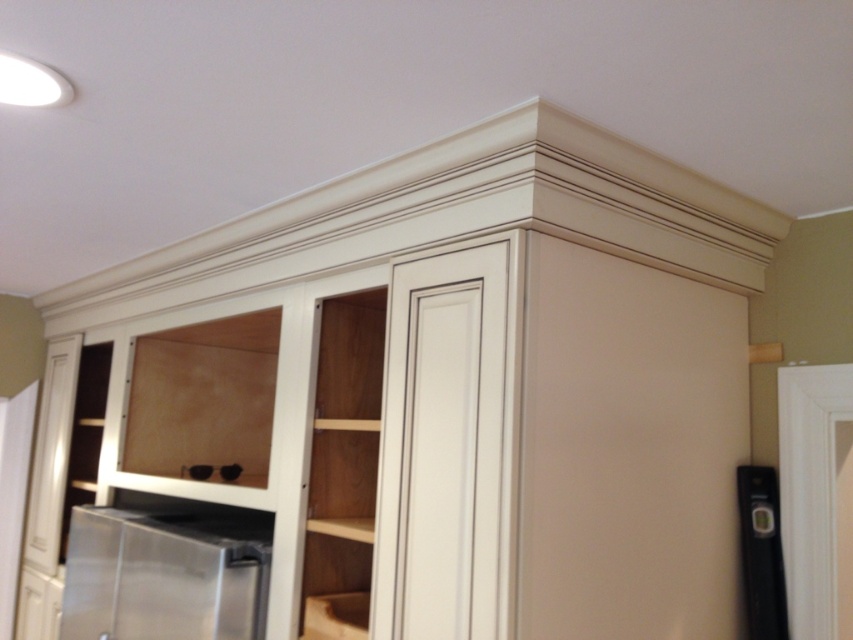
You are organizing the kitchen and need to place a new appliance between the stainless steel refrigerator at lower left and the black plastic level at lower right. Which side should you place it closer to the refrigerator to ensure it fits within the available space?

The stainless steel refrigerator at lower left is to the left of the black plastic level at lower right, so placing the appliance closer to the refrigerator would mean positioning it on the left side between them, ensuring it fits within the available space.

Based on the photo, you are standing in the kitchen and see two points marked on the wall. The first point is at coordinate point (137,560) and the second is at coordinate point (752,577). From your perspective, which point is closer to you?

Point (752,577) is closer to you because it is in front of point (137,560) according to their spatial arrangement.

Consider the image. You are trying to decide where to place a new kitchen appliance that requires a certain height clearance. You see the stainless steel refrigerator at lower left and the black plastic level at lower right. Which object has a greater height?

The stainless steel refrigerator at lower left is much taller than the black plastic level at lower right, so it has a greater height.